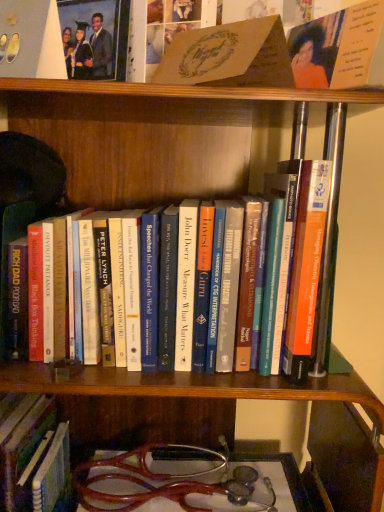
Question: Is matte black graduation gown at upper left to the left of hardcover book at center, placed as the 3th book when sorted from top to bottom, from the viewer's perspective?

Choices:
 (A) no
 (B) yes

Answer: (B)

Question: Considering the relative sizes of matte black graduation gown at upper left and hardcover book at center, which appears as the 2th book when ordered from the bottom, in the image provided, is matte black graduation gown at upper left bigger than hardcover book at center, which appears as the 2th book when ordered from the bottom,?

Choices:
 (A) no
 (B) yes

Answer: (A)

Question: Can you confirm if matte black graduation gown at upper left is shorter than hardcover book at center, placed as the 3th book when sorted from top to bottom?

Choices:
 (A) no
 (B) yes

Answer: (B)

Question: Is matte black graduation gown at upper left taller than hardcover book at center, placed as the 3th book when sorted from top to bottom?

Choices:
 (A) no
 (B) yes

Answer: (A)

Question: Is matte black graduation gown at upper left located outside hardcover book at center, placed as the 3th book when sorted from top to bottom?

Choices:
 (A) yes
 (B) no

Answer: (A)

Question: Does point (178, 53) appear closer or farther from the camera than point (155, 246)?

Choices:
 (A) farther
 (B) closer

Answer: (B)

Question: From a real-world perspective, is matte brown card at upper center, the 3th book from the bottom, positioned above or below hardcover book at center, which appears as the 2th book when ordered from the bottom?

Choices:
 (A) below
 (B) above

Answer: (B)

Question: In terms of size, does matte brown card at upper center, which ranks as the second book in top-to-bottom order, appear bigger or smaller than hardcover book at center, placed as the 3th book when sorted from top to bottom?

Choices:
 (A) big
 (B) small

Answer: (B)

Question: Considering their positions, is matte brown card at upper center, which ranks as the second book in top-to-bottom order, located in front of or behind hardcover book at center, placed as the 3th book when sorted from top to bottom?

Choices:
 (A) behind
 (B) front

Answer: (B)

Question: From their relative heights in the image, would you say hardcover book at center, which is the 4th book from top to bottom, is taller or shorter than orange matte card at upper right, the 4th book ordered from the bottom?

Choices:
 (A) short
 (B) tall

Answer: (B)

Question: Based on their positions, is hardcover book at center, which is the 1th book from bottom to top, located to the left or right of orange matte card at upper right, the 4th book ordered from the bottom?

Choices:
 (A) right
 (B) left

Answer: (B)

Question: From the image's perspective, is hardcover book at center, which is the 1th book from bottom to top, above or below orange matte card at upper right, the 4th book ordered from the bottom?

Choices:
 (A) above
 (B) below

Answer: (B)

Question: Would you say hardcover book at center, which is the 1th book from bottom to top, is inside or outside orange matte card at upper right, acting as the first book starting from the top?

Choices:
 (A) inside
 (B) outside

Answer: (B)

Question: Considering the positions of hardcover book at center, which is the 1th book from bottom to top, and matte brown card at upper center, which ranks as the second book in top-to-bottom order, in the image, is hardcover book at center, which is the 1th book from bottom to top, taller or shorter than matte brown card at upper center, which ranks as the second book in top-to-bottom order,?

Choices:
 (A) short
 (B) tall

Answer: (B)

Question: From the image's perspective, is hardcover book at center, which is the 4th book from top to bottom, located above or below matte brown card at upper center, which ranks as the second book in top-to-bottom order?

Choices:
 (A) below
 (B) above

Answer: (A)